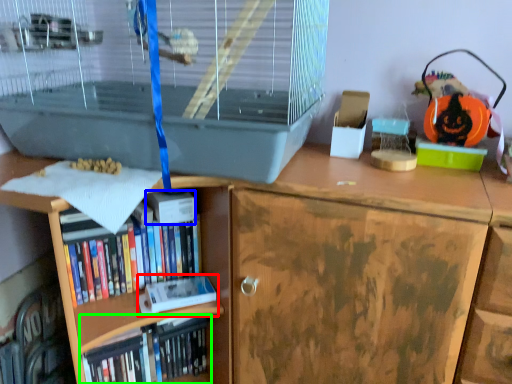
Question: Which object is positioned farthest from paperback book (highlighted by a red box)? Select from paperback book (highlighted by a blue box) and book (highlighted by a green box).

Choices:
 (A) paperback book
 (B) book

Answer: (A)